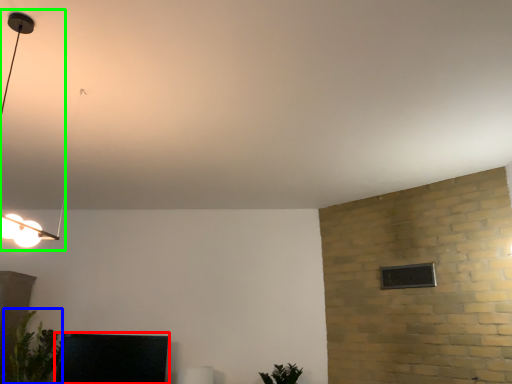
Question: Considering the real-world distances, which object is closest to furniture (highlighted by a red box)? plant (highlighted by a blue box) or lamp (highlighted by a green box).

Choices:
 (A) plant
 (B) lamp

Answer: (A)